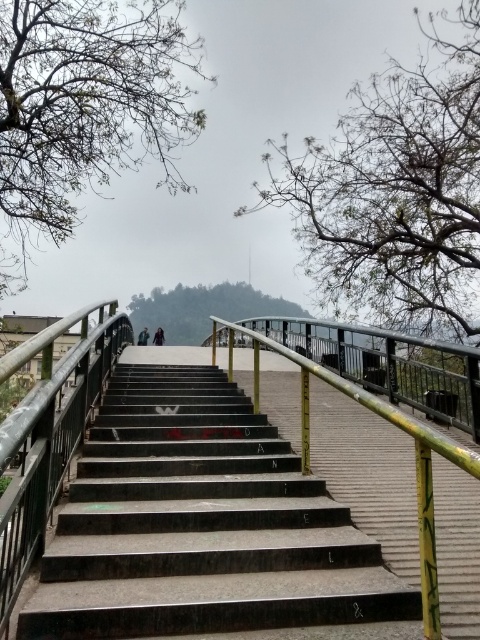
Does bare branches at upper left appear on the right side of dark brown leather jacket at center?

Incorrect, bare branches at upper left is not on the right side of dark brown leather jacket at center.

You are a GUI agent. You are given a task and a screenshot of the screen. Output one action in this format:
    pyautogui.click(x=<x>, y=<y>)
    Task: Click on the bare branches at upper left
    The height and width of the screenshot is (640, 480).
    Given the screenshot: What is the action you would take?
    pyautogui.click(x=85, y=108)

Is point (0, 44) farther from viewer compared to point (157, 333)?

No, it is not.

Where is `bare branches at upper left`? The width and height of the screenshot is (480, 640). bare branches at upper left is located at coordinates coord(85,108).

Which is behind, point (192, 305) or point (164, 337)?

Positioned behind is point (164, 337).

Is green leafy tree at center taller than dark brown leather jacket at center?

Yes.

Between point (203, 333) and point (160, 342), which one is positioned behind?

Point (160, 342)

At what (x,y) coordinates should I click in order to perform the action: click on green leafy tree at center. Please return your answer as a coordinate pair (x, y). This screenshot has height=640, width=480. Looking at the image, I should click on (204, 308).

Does point (108, 483) come closer to viewer compared to point (157, 339)?

Yes.

At what (x,y) coordinates should I click in order to perform the action: click on black polished stairs at center. Please return your answer as a coordinate pair (x, y). Image resolution: width=480 pixels, height=640 pixels. Looking at the image, I should click on (204, 529).